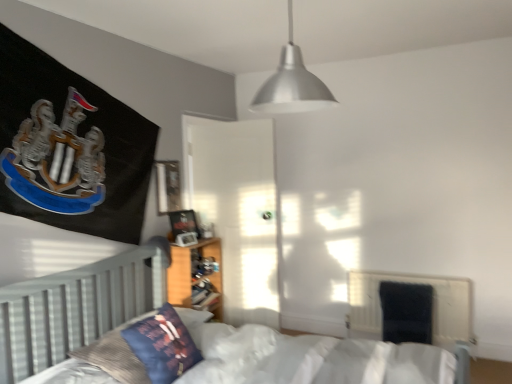
Question: Is velvet dark blue armchair at lower right behind white wooden bed at center?

Choices:
 (A) no
 (B) yes

Answer: (B)

Question: Can you confirm if velvet dark blue armchair at lower right is bigger than white wooden bed at center?

Choices:
 (A) no
 (B) yes

Answer: (A)

Question: From a real-world perspective, is velvet dark blue armchair at lower right under white wooden bed at center?

Choices:
 (A) yes
 (B) no

Answer: (A)

Question: From a real-world perspective, does velvet dark blue armchair at lower right stand above white wooden bed at center?

Choices:
 (A) yes
 (B) no

Answer: (B)

Question: Can you confirm if velvet dark blue armchair at lower right is shorter than white wooden bed at center?

Choices:
 (A) yes
 (B) no

Answer: (A)

Question: Does velvet dark blue armchair at lower right have a greater width compared to white wooden bed at center?

Choices:
 (A) yes
 (B) no

Answer: (B)

Question: Can you confirm if black fabric radiator at lower right is taller than velvet dark blue armchair at lower right?

Choices:
 (A) no
 (B) yes

Answer: (B)

Question: Does black fabric radiator at lower right appear on the right side of velvet dark blue armchair at lower right?

Choices:
 (A) no
 (B) yes

Answer: (B)

Question: Is black fabric radiator at lower right outside of velvet dark blue armchair at lower right?

Choices:
 (A) yes
 (B) no

Answer: (A)

Question: Is black fabric radiator at lower right aimed at velvet dark blue armchair at lower right?

Choices:
 (A) yes
 (B) no

Answer: (A)

Question: Is black fabric radiator at lower right in front of velvet dark blue armchair at lower right?

Choices:
 (A) no
 (B) yes

Answer: (B)

Question: From a real-world perspective, is black fabric radiator at lower right under velvet dark blue armchair at lower right?

Choices:
 (A) yes
 (B) no

Answer: (A)

Question: Is metallic silver pendant light at upper center behind black fabric radiator at lower right?

Choices:
 (A) yes
 (B) no

Answer: (B)